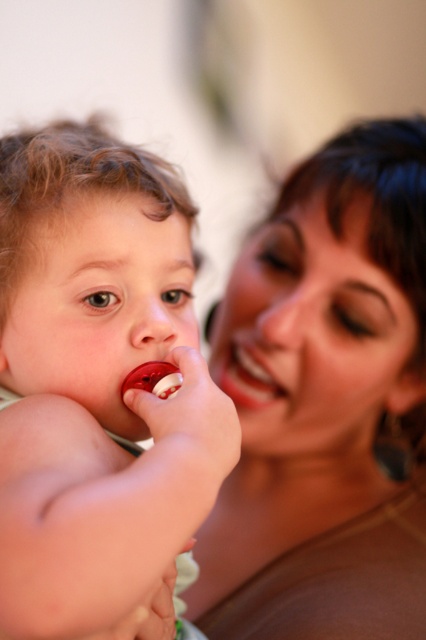
Who is positioned more to the right, smooth skin face at upper right or smooth matte lips at center?

smooth skin face at upper right is more to the right.

Is smooth skin face at upper right taller than smooth matte lips at center?

Indeed, smooth skin face at upper right has a greater height compared to smooth matte lips at center.

Where is `smooth skin face at upper right`? This screenshot has height=640, width=426. smooth skin face at upper right is located at coordinates (328, 403).

Can you confirm if rubber pacifier at left is shorter than smooth matte lips at center?

No.

Which is more to the left, rubber pacifier at left or smooth matte lips at center?

rubber pacifier at left

Is point (166, 342) positioned after point (236, 401)?

That is False.

Where is `rubber pacifier at left`? Image resolution: width=426 pixels, height=640 pixels. rubber pacifier at left is located at coordinates (97, 387).

Does smooth skin face at upper right have a greater width compared to rubber pacifier at left?

Yes, smooth skin face at upper right is wider than rubber pacifier at left.

Which is below, smooth skin face at upper right or rubber pacifier at left?

smooth skin face at upper right is lower down.

Find the location of a particular element. smooth skin face at upper right is located at coordinates (328, 403).

Where is `smooth skin face at upper right`? smooth skin face at upper right is located at coordinates (328, 403).